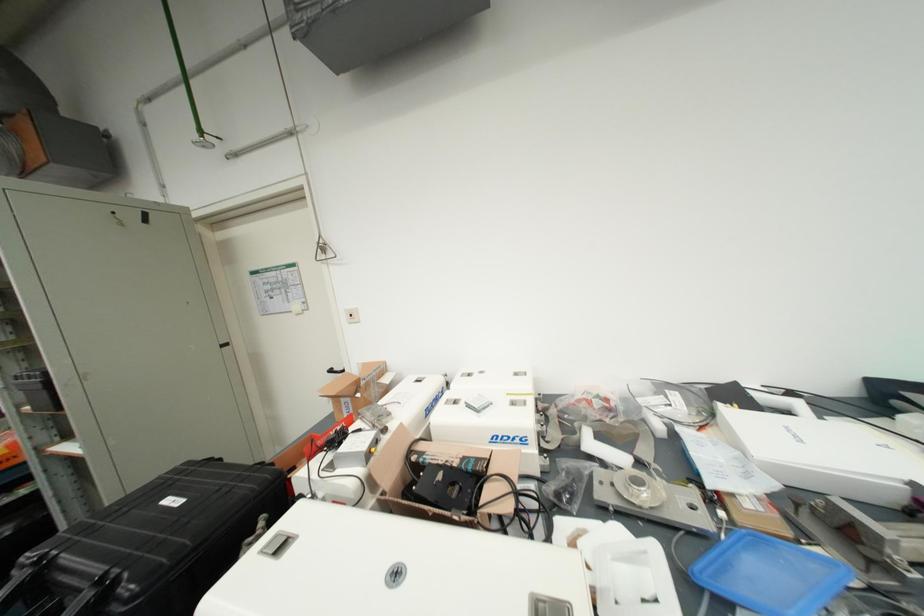
The image size is (924, 616). What do you see at coordinates (277, 544) in the screenshot? I see `the inset device handle` at bounding box center [277, 544].